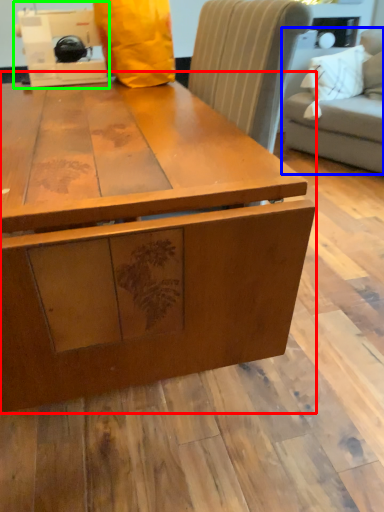
Question: Which object is positioned farthest from table (highlighted by a red box)? Select from studio couch (highlighted by a blue box) and sewing machine (highlighted by a green box).

Choices:
 (A) studio couch
 (B) sewing machine

Answer: (A)